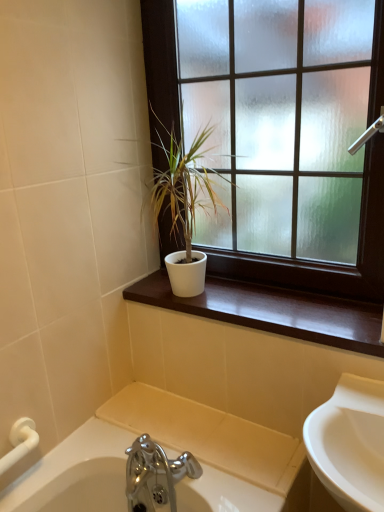
I want to click on vacant space that's between white matte window at upper center and white matte pot at center, so click(279, 311).